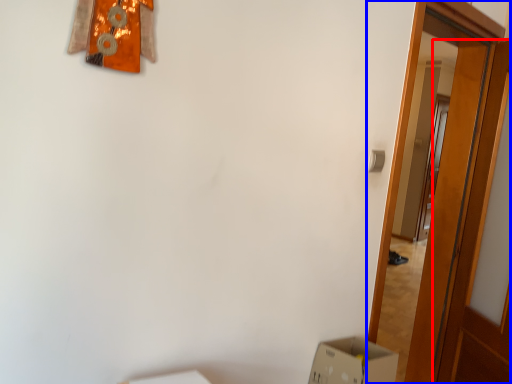
Question: Which point is closer to the camera, door (highlighted by a red box) or door (highlighted by a blue box)?

Choices:
 (A) door
 (B) door

Answer: (B)